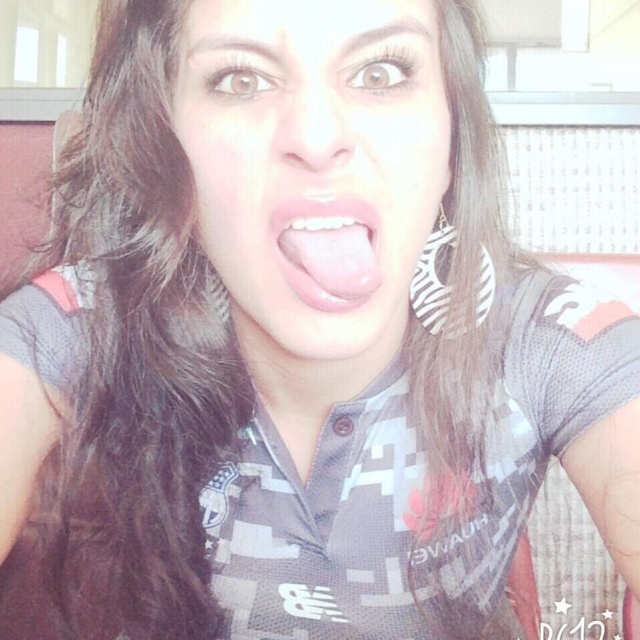
Between matte skin face at center and pink glossy tongue at center, which one appears on the left side from the viewer's perspective?

From the viewer's perspective, matte skin face at center appears more on the left side.

Does point (284, 326) come behind point (314, 241)?

Yes, point (284, 326) is farther from viewer.

Find the location of a particular element. The height and width of the screenshot is (640, 640). matte skin face at center is located at coordinates (314, 163).